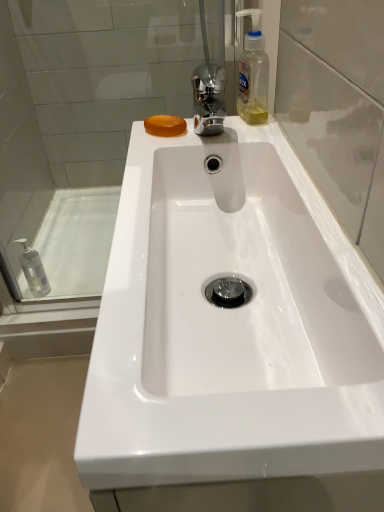
What do you see at coordinates (337, 108) in the screenshot?
I see `transparent glass door at upper right` at bounding box center [337, 108].

Locate an element on the screen. The image size is (384, 512). transparent glass door at upper right is located at coordinates (337, 108).

The height and width of the screenshot is (512, 384). I want to click on white glossy sink at center, so click(x=229, y=324).

What is the approximate height of clear plastic mouthwash at left?

clear plastic mouthwash at left is 9.88 inches in height.

Measure the distance between point (167, 126) and camera.

26.81 inches.

The image size is (384, 512). Find the location of `transparent glass door at upper right`. transparent glass door at upper right is located at coordinates (337, 108).

Can you confirm if transparent glass shower door at upper left is thinner than white glossy sink at center?

Correct, the width of transparent glass shower door at upper left is less than that of white glossy sink at center.

Image resolution: width=384 pixels, height=512 pixels. Find the location of `sink directly beneath the transparent glass shower door at upper left (from a real-world perspective)`. sink directly beneath the transparent glass shower door at upper left (from a real-world perspective) is located at coordinates (229, 324).

Considering the sizes of objects transparent glass shower door at upper left and white glossy sink at center in the image provided, who is shorter, transparent glass shower door at upper left or white glossy sink at center?

white glossy sink at center.

Is orange translucent soap at upper left beside clear plastic mouthwash at left?

There is a gap between orange translucent soap at upper left and clear plastic mouthwash at left.

From a real-world perspective, is orange translucent soap at upper left above or below clear plastic mouthwash at left?

Clearly, from a real-world perspective, orange translucent soap at upper left is above clear plastic mouthwash at left.

From the image's perspective, would you say orange translucent soap at upper left is shown under clear plastic mouthwash at left?

No, from the image's perspective, orange translucent soap at upper left is not below clear plastic mouthwash at left.

What's the angular difference between transparent glass door at upper right and orange translucent soap at upper left's facing directions?

They differ by 2.75 degrees in their facing directions.

Is transparent glass door at upper right beside orange translucent soap at upper left?

transparent glass door at upper right and orange translucent soap at upper left are clearly separated.

Is transparent glass door at upper right situated inside orange translucent soap at upper left or outside?

transparent glass door at upper right is outside orange translucent soap at upper left.

From a real-world perspective, is transparent glass door at upper right above or below orange translucent soap at upper left?

transparent glass door at upper right is above orange translucent soap at upper left.

Find the location of a particular element. Image resolution: width=384 pixels, height=512 pixels. bath on the left side of orange translucent soap at upper left is located at coordinates (77, 240).

Which of these two, white glossy bath at left or orange translucent soap at upper left, is thinner?

orange translucent soap at upper left is thinner.

Does white glossy bath at left appear on the right side of orange translucent soap at upper left?

No, white glossy bath at left is not to the right of orange translucent soap at upper left.

Based on the photo, does white glossy bath at left have a smaller size compared to orange translucent soap at upper left?

No, white glossy bath at left is not smaller than orange translucent soap at upper left.

Considering the positions of points (40, 173) and (60, 255), is point (40, 173) closer to camera compared to point (60, 255)?

No, it is not.

Could you tell me if transparent glass shower door at upper left is turned towards white glossy bath at left?

No, transparent glass shower door at upper left is not aimed at white glossy bath at left.

From a real-world perspective, is transparent glass shower door at upper left beneath white glossy bath at left?

Actually, transparent glass shower door at upper left is physically above white glossy bath at left in the real world.

How much distance is there between transparent glass shower door at upper left and white glossy bath at left?

They are 34.83 centimeters apart.

From the picture: How many degrees apart are the facing directions of white glossy sink at center and orange translucent soap at upper left?

2.32 degrees separate the facing orientations of white glossy sink at center and orange translucent soap at upper left.

From the image's perspective, is white glossy sink at center beneath orange translucent soap at upper left?

Yes.

Is white glossy sink at center looking in the opposite direction of orange translucent soap at upper left?

white glossy sink at center is not turned away from orange translucent soap at upper left.

Can you confirm if white glossy sink at center is taller than orange translucent soap at upper left?

Yes, white glossy sink at center is taller than orange translucent soap at upper left.

Find the location of `glass door on the right of clear plastic mouthwash at left`. glass door on the right of clear plastic mouthwash at left is located at coordinates click(x=337, y=108).

Does transparent glass door at upper right turn towards clear plastic mouthwash at left?

No, transparent glass door at upper right does not turn towards clear plastic mouthwash at left.

Image resolution: width=384 pixels, height=512 pixels. Find the location of `sink on the right of transparent glass shower door at upper left`. sink on the right of transparent glass shower door at upper left is located at coordinates (229, 324).

Find the location of `soap above the clear plastic mouthwash at left (from a real-world perspective)`. soap above the clear plastic mouthwash at left (from a real-world perspective) is located at coordinates (165, 126).

From the image, which object appears to be nearer to transparent glass shower door at upper left, clear plastic mouthwash at left or white glossy bath at left?

The object closer to transparent glass shower door at upper left is white glossy bath at left.

When comparing their distances from clear plastic mouthwash at left, does white glossy bath at left or transparent glass shower door at upper left seem closer?

white glossy bath at left is closer to clear plastic mouthwash at left.

When comparing their distances from orange translucent soap at upper left, does clear plastic bottle at upper right or transparent glass door at upper right seem further?

Among the two, transparent glass door at upper right is located further to orange translucent soap at upper left.

Considering their positions, is clear plastic bottle at upper right positioned further to transparent glass door at upper right than transparent glass shower door at upper left?

The object further to transparent glass door at upper right is transparent glass shower door at upper left.

Looking at the image, which one is located closer to orange translucent soap at upper left, white glossy sink at center or transparent glass door at upper right?

transparent glass door at upper right.

From the image, which object appears to be farther from white glossy bath at left, transparent glass shower door at upper left or white glossy sink at center?

Based on the image, white glossy sink at center appears to be further to white glossy bath at left.

Which object lies further to the anchor point transparent glass door at upper right, clear plastic mouthwash at left or transparent glass shower door at upper left?

clear plastic mouthwash at left lies further to transparent glass door at upper right than the other object.

Looking at the image, which one is located closer to white glossy bath at left, white glossy sink at center or transparent glass shower door at upper left?

Among the two, transparent glass shower door at upper left is located nearer to white glossy bath at left.

Where is `soap dispenser between white glossy sink at center and white glossy bath at left in the front-back direction`? The height and width of the screenshot is (512, 384). soap dispenser between white glossy sink at center and white glossy bath at left in the front-back direction is located at coordinates (253, 73).

The width and height of the screenshot is (384, 512). Find the location of `soap located between transparent glass door at upper right and white glossy bath at left in the depth direction`. soap located between transparent glass door at upper right and white glossy bath at left in the depth direction is located at coordinates (165, 126).

The height and width of the screenshot is (512, 384). What are the coordinates of `soap positioned between transparent glass door at upper right and transparent glass shower door at upper left from near to far` in the screenshot? It's located at (165, 126).

Image resolution: width=384 pixels, height=512 pixels. Find the location of `shower door between transparent glass door at upper right and white glossy bath at left along the z-axis`. shower door between transparent glass door at upper right and white glossy bath at left along the z-axis is located at coordinates (83, 94).